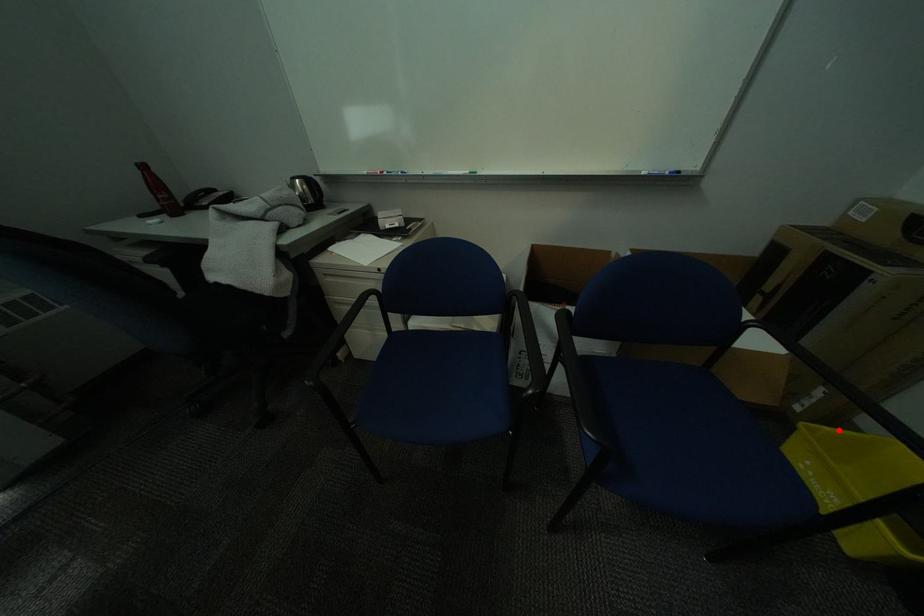
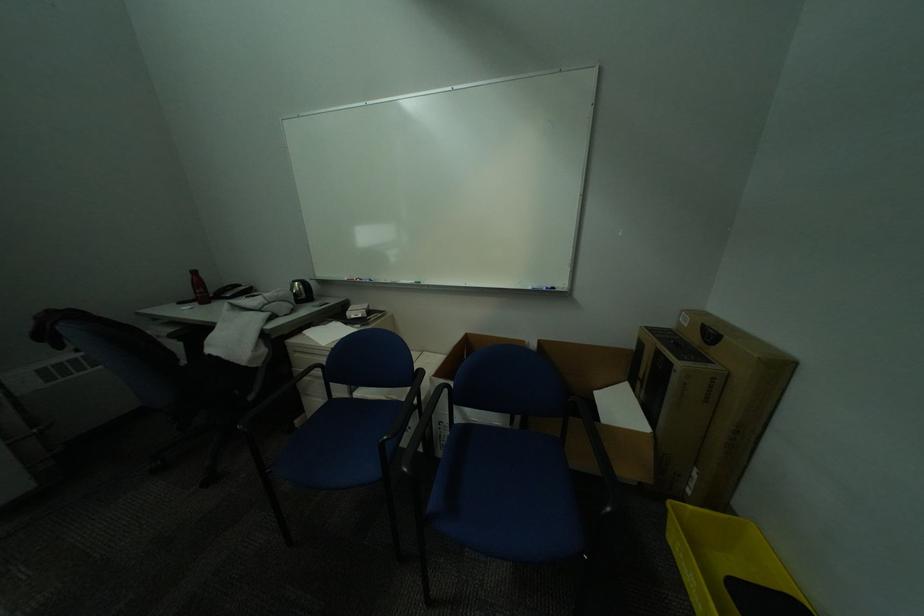
Locate, in the second image, the point that corresponds to the highlighted location in the first image.

(701, 508)